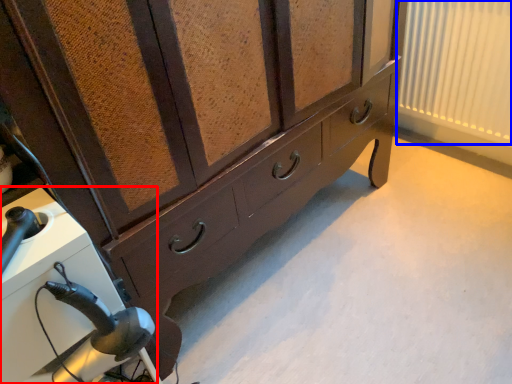
Question: Which of the following is the closest to the observer, appliance (highlighted by a red box) or curtain (highlighted by a blue box)?

Choices:
 (A) appliance
 (B) curtain

Answer: (A)